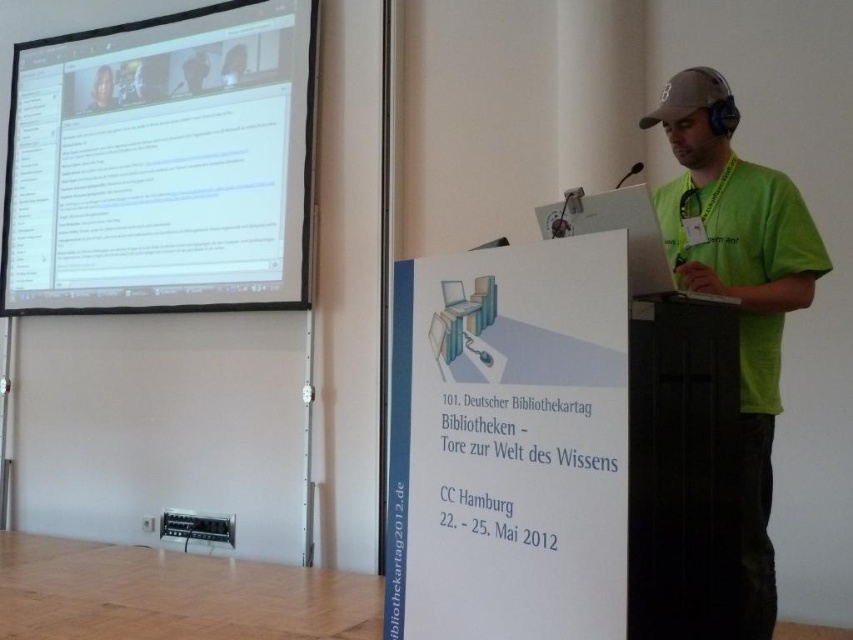
Question: Does white glossy projector screen at upper left appear on the right side of smooth skin face at upper left?

Choices:
 (A) no
 (B) yes

Answer: (B)

Question: Which point is farther to the camera?

Choices:
 (A) white glossy projector screen at upper left
 (B) smooth skin face at upper left
 (C) green t-shirt at center

Answer: (B)

Question: Which point is closer to the camera taking this photo?

Choices:
 (A) (160, 28)
 (B) (729, 163)
 (C) (99, 90)

Answer: (B)

Question: Is white glossy projector screen at upper left above smooth skin face at upper left?

Choices:
 (A) no
 (B) yes

Answer: (A)

Question: Does white glossy projector screen at upper left appear on the left side of smooth skin face at upper left?

Choices:
 (A) no
 (B) yes

Answer: (A)

Question: Estimate the real-world distances between objects in this image. Which object is farther from the smooth skin face at upper left?

Choices:
 (A) green t-shirt at center
 (B) white glossy projector screen at upper left

Answer: (A)